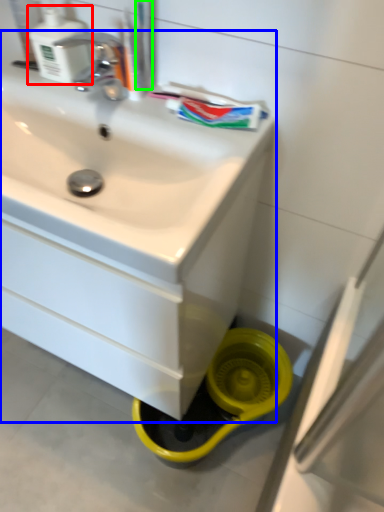
Question: Based on their relative distances, which object is nearer to soap dispenser (highlighted by a red box)? Choose from sink (highlighted by a blue box) and toothbrush (highlighted by a green box).

Choices:
 (A) sink
 (B) toothbrush

Answer: (B)